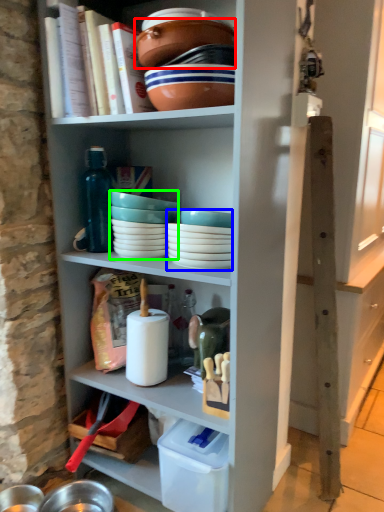
Question: Considering the real-world distances, which object is closest to bowl (highlighted by a red box)? tableware (highlighted by a blue box) or tableware (highlighted by a green box).

Choices:
 (A) tableware
 (B) tableware

Answer: (B)